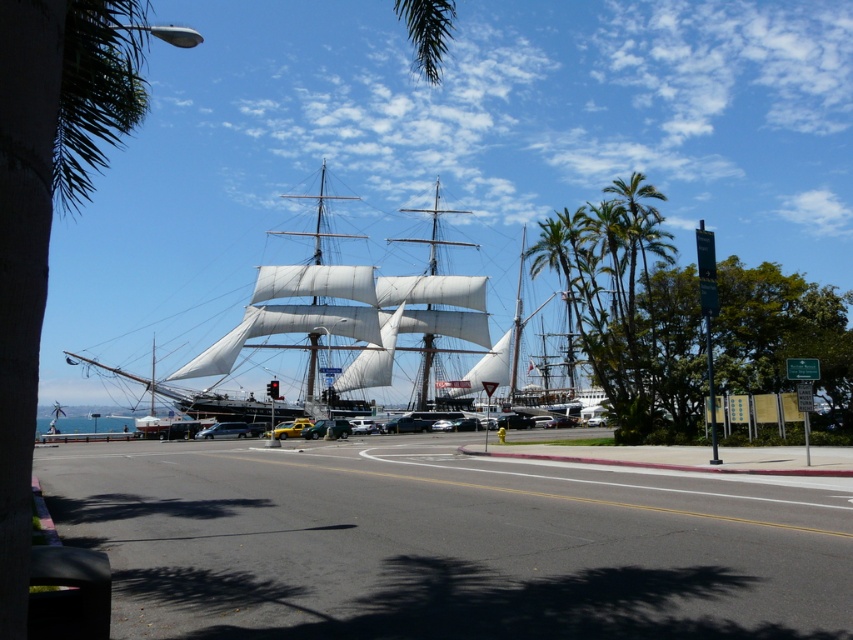
Question: Among these points, which one is farthest from the camera?

Choices:
 (A) (239, 436)
 (B) (521, 323)

Answer: (B)

Question: Is white canvas sailboat at center to the right of wooden mast at center from the viewer's perspective?

Choices:
 (A) yes
 (B) no

Answer: (B)

Question: Does white canvas sailboat at center appear on the right side of green leafy palm tree at center-right?

Choices:
 (A) yes
 (B) no

Answer: (B)

Question: Which is nearer to the metallic silver car at center?

Choices:
 (A) green leafy palm tree at center-right
 (B) wooden mast at center
 (C) white canvas sailboat at center

Answer: (C)

Question: Can you confirm if green leafy palm tree at center-right is positioned to the left of metallic silver car at center?

Choices:
 (A) no
 (B) yes

Answer: (A)

Question: Which of the following is the farthest from the observer?

Choices:
 (A) (311, 324)
 (B) (515, 310)
 (C) (219, 435)

Answer: (B)